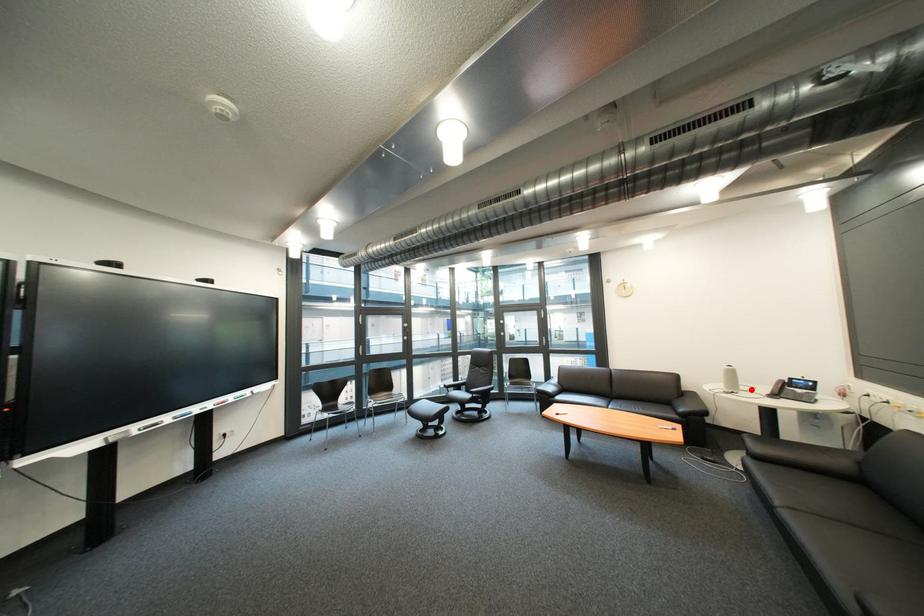
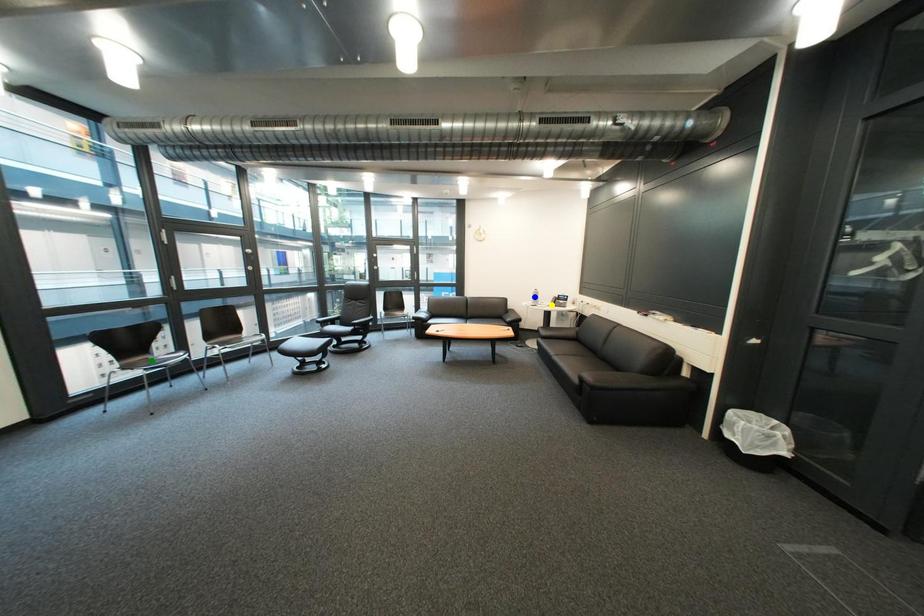
Question: I am providing you with two images of the same scene from different viewpoints. A red point is marked on the first image. You are given multiple points on the second image. Which mark in image 2 goes with the point in image 1?

Choices:
 (A) green point
 (B) yellow point
 (C) blue point

Answer: (B)